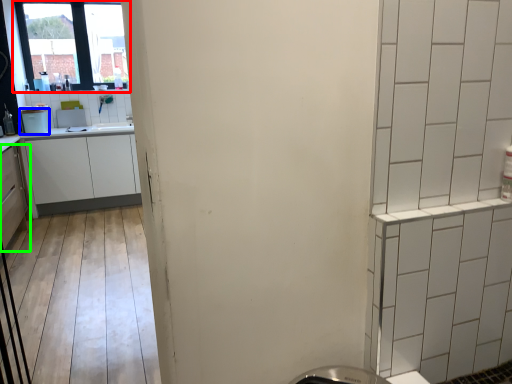
Question: Based on their relative distances, which object is farther from window (highlighted by a red box)? Choose from appliance (highlighted by a blue box) and cabinetry (highlighted by a green box).

Choices:
 (A) appliance
 (B) cabinetry

Answer: (B)